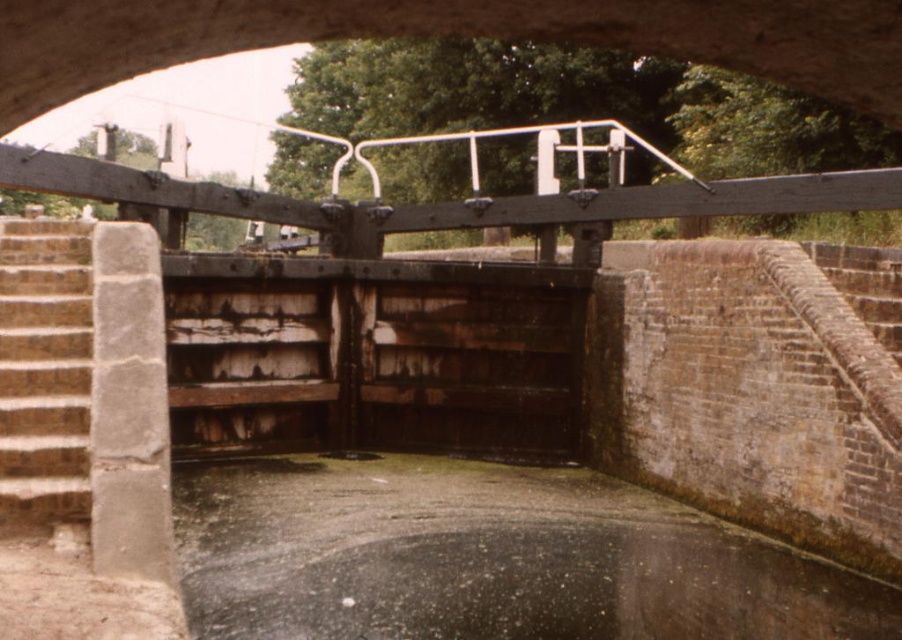
Is point (14, 282) positioned before point (378, 458)?

Yes, point (14, 282) is in front of point (378, 458).

Who is more distant from viewer, (44,294) or (325,452)?

Positioned behind is point (325,452).

Describe the element at coordinates (44, 369) in the screenshot. This screenshot has width=902, height=640. I see `brown stone stairs at left` at that location.

Where is `brown stone stairs at left`? The image size is (902, 640). brown stone stairs at left is located at coordinates (44, 369).